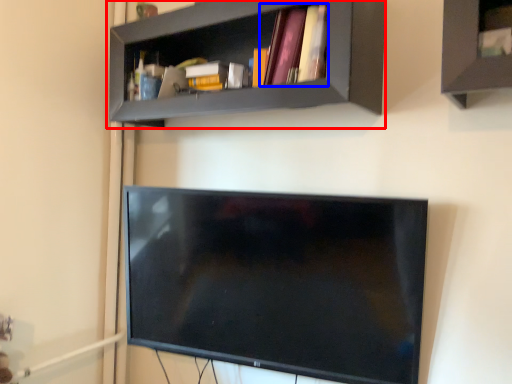
Question: Among these objects, which one is nearest to the camera, shelf (highlighted by a red box) or book (highlighted by a blue box)?

Choices:
 (A) shelf
 (B) book

Answer: (A)